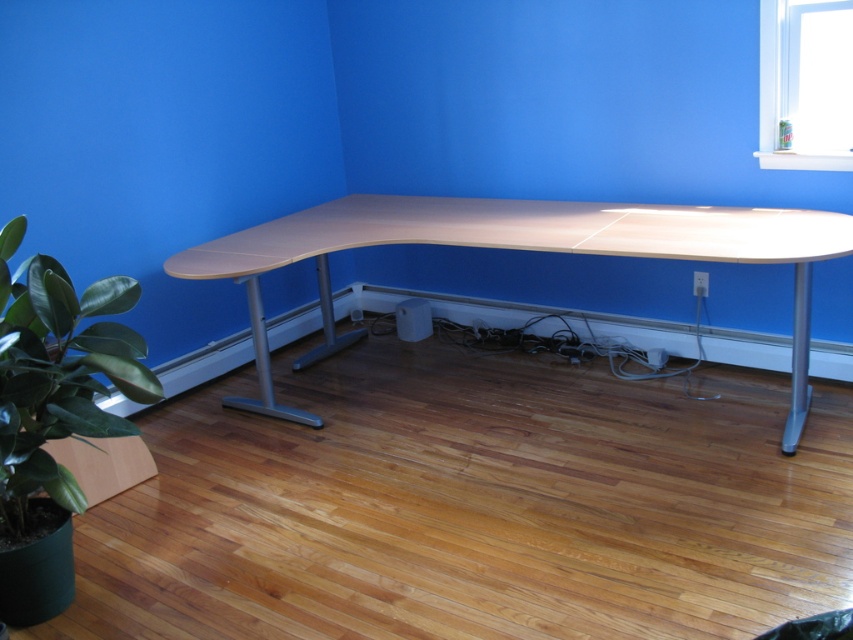
Does point (190, 260) lie behind point (776, 26)?

Yes, it is.

Measure the distance between light wood/wooden table at center and clear glass window at upper right.

light wood/wooden table at center and clear glass window at upper right are 31.87 inches apart.

Where is `light wood/wooden table at center`? The width and height of the screenshot is (853, 640). light wood/wooden table at center is located at coordinates (521, 250).

Locate an element on the screen. The width and height of the screenshot is (853, 640). light wood/wooden table at center is located at coordinates (521, 250).

Can you confirm if light wood/wooden table at center is positioned to the left of green rubbery plant at lower left?

Incorrect, light wood/wooden table at center is not on the left side of green rubbery plant at lower left.

Where is `light wood/wooden table at center`? This screenshot has width=853, height=640. light wood/wooden table at center is located at coordinates (521, 250).

From the picture: Is green rubbery plant at lower left taller than clear glass window at upper right?

Yes.

Can you confirm if green rubbery plant at lower left is shorter than clear glass window at upper right?

No, green rubbery plant at lower left is not shorter than clear glass window at upper right.

You are a GUI agent. You are given a task and a screenshot of the screen. Output one action in this format:
    pyautogui.click(x=<x>, y=<y>)
    Task: Click on the green rubbery plant at lower left
    Image resolution: width=853 pixels, height=640 pixels.
    Given the screenshot: What is the action you would take?
    pyautogui.click(x=57, y=374)